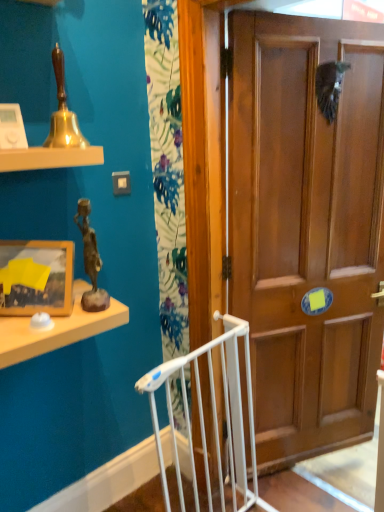
Question: From the image's perspective, relative to wooden framed picture at left, is wooden door at center above or below?

Choices:
 (A) below
 (B) above

Answer: (B)

Question: Considering the positions of point tap(344, 161) and point tap(64, 278), is point tap(344, 161) closer or farther from the camera than point tap(64, 278)?

Choices:
 (A) farther
 (B) closer

Answer: (A)

Question: Considering the real-world distances, which object is closest to the bronze statue at upper left?

Choices:
 (A) wooden door at center
 (B) wooden framed picture at left

Answer: (B)

Question: Based on their relative distances, which object is nearer to the bronze statue at upper left?

Choices:
 (A) wooden door at center
 (B) wooden framed picture at left

Answer: (B)